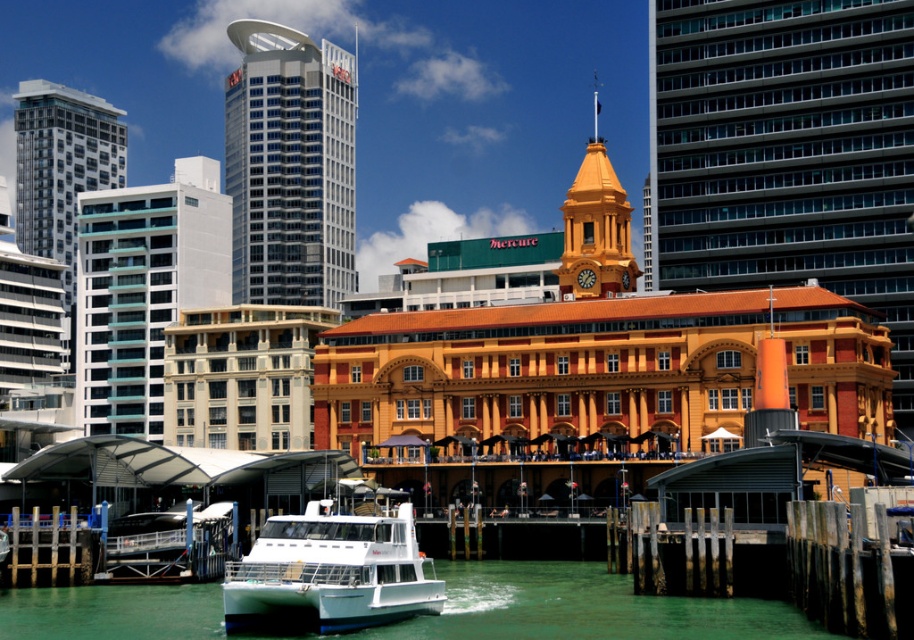
You are a photographer planning to capture a wide shot of the waterfront scene. You want to ensure that both the white glossy boat at lower center and the matte glass building at left are fully visible in your frame. Given their widths, which object should you position closer to the edge of the frame to avoid cropping?

Since the white glossy boat at lower center is narrower than the matte glass building at left, you should position the wider matte glass building at left closer to the edge of the frame to ensure both fit without cropping.

You are a drone operator tasked with capturing aerial footage of the orange building with a clock tower. You notice two other structures in the frame, the glassy blue skyscraper at upper left and the matte glass building at left. From your current position, which of these two buildings is positioned higher in the sky?

The glassy blue skyscraper at upper left is positioned higher in the sky than the matte glass building at left.

You are standing on the dock and see the white glossy boat at lower center and the glassy blue skyscraper at upper left. Which object is closer to you?

The white glossy boat at lower center is behind the glassy blue skyscraper at upper left, so the glassy blue skyscraper at upper left is closer to you.